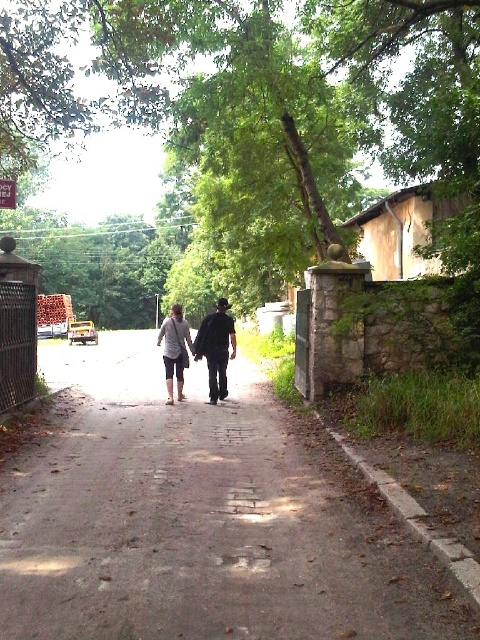
Question: Can you confirm if dull gray concrete path at center is positioned above light gray cotton shorts at center?

Choices:
 (A) no
 (B) yes

Answer: (A)

Question: Which of the following is the farthest from the observer?

Choices:
 (A) dull gray concrete path at center
 (B) light gray cotton shorts at center
 (C) dark gray fabric pants at center

Answer: (B)

Question: Which object is farther from the camera taking this photo?

Choices:
 (A) dull gray concrete path at center
 (B) light gray cotton shorts at center
 (C) dark gray fabric pants at center

Answer: (B)

Question: Is dull gray concrete path at center smaller than dark gray fabric pants at center?

Choices:
 (A) no
 (B) yes

Answer: (A)

Question: Is dull gray concrete path at center to the left of light gray cotton shorts at center from the viewer's perspective?

Choices:
 (A) yes
 (B) no

Answer: (B)

Question: Based on their relative distances, which object is nearer to the dark gray fabric pants at center?

Choices:
 (A) light gray cotton shorts at center
 (B) dull gray concrete path at center

Answer: (A)